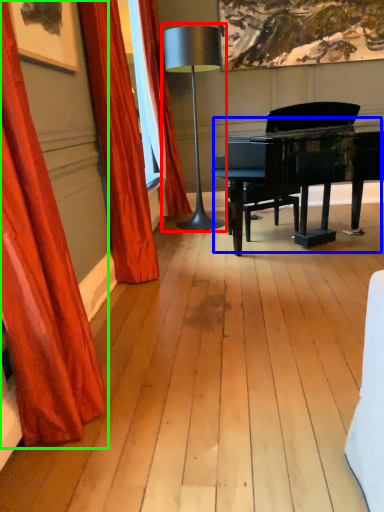
Question: Which is nearer to the table lamp (highlighted by a red box)? piano (highlighted by a blue box) or curtain (highlighted by a green box).

Choices:
 (A) piano
 (B) curtain

Answer: (A)